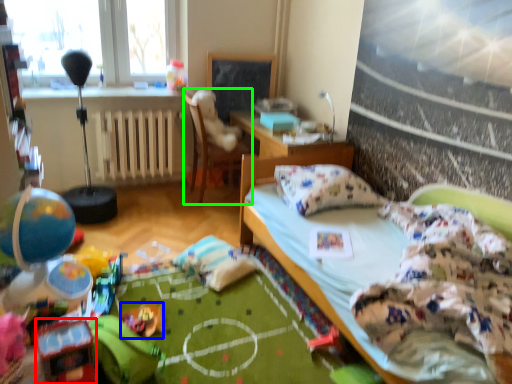
Question: Estimate the real-world distances between objects in this image. Which object is farther from toy (highlighted by a red box), toy (highlighted by a blue box) or chair (highlighted by a green box)?

Choices:
 (A) toy
 (B) chair

Answer: (B)